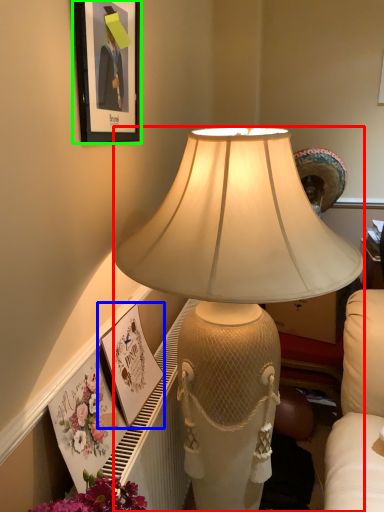
Question: Based on their relative distances, which object is nearer to lamp (highlighted by a red box)? Choose from picture frame (highlighted by a blue box) and picture frame (highlighted by a green box).

Choices:
 (A) picture frame
 (B) picture frame

Answer: (B)